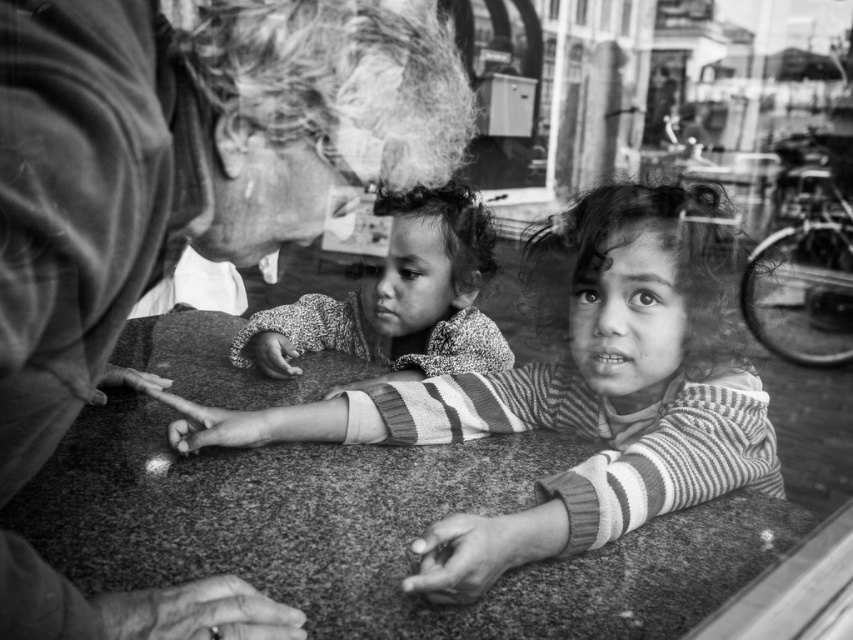
You are a photographer trying to capture a candid shot of the scene through the reflective surface. You need to ensure that both the smooth textured hair at upper left and the speckled sweater at center are in focus. Given that your camera can only focus on objects within a 50 cm range, will you be able to capture both subjects clearly?

The distance between the smooth textured hair at upper left and the speckled sweater at center is 77.57 centimeters, which exceeds the camera focus range of 50 cm. Therefore, you cannot capture both subjects clearly in focus with the current settings.

You are standing in front of the photograph and notice two points marked on it. The first point is at coordinates point (202,202), and the second is at point (431,188). Based on the reflection in the photograph, which point is closer to you?

Point (202,202) is closer to the viewer than point (431,188).

In the photograph, you notice the smooth textured hair at upper left and the striped sweater at center. Which of these two items appears narrower in the image?

The smooth textured hair at upper left appears narrower than the striped sweater at center because it has a lesser width compared to the striped sweater at center.